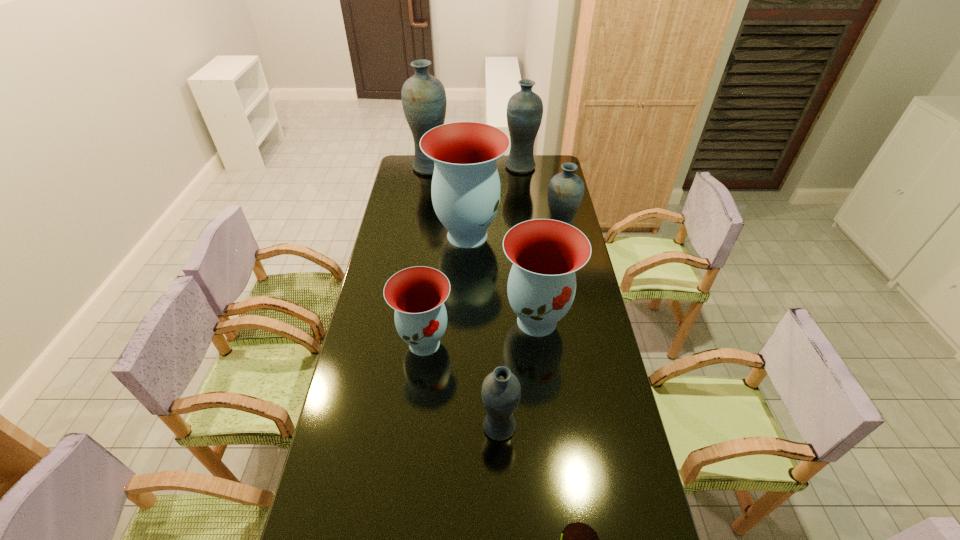
You are a GUI agent. You are given a task and a screenshot of the screen. Output one action in this format:
    pyautogui.click(x=<x>, y=<y>)
    Task: Click on the biggest blue vase
    Image resolution: width=960 pixels, height=540 pixels.
    Given the screenshot: What is the action you would take?
    pyautogui.click(x=424, y=101)

Find the location of a particular element. The image size is (960, 540). the tallest object is located at coordinates (424, 101).

At what (x,y) coordinates should I click in order to perform the action: click on the second biggest blue vase. Please return your answer as a coordinate pair (x, y). This screenshot has width=960, height=540. Looking at the image, I should click on (524, 112).

At what (x,y) coordinates should I click in order to perform the action: click on the biggest red vase. Please return your answer as a coordinate pair (x, y). This screenshot has height=540, width=960. Looking at the image, I should click on (466, 192).

Identify the location of the second smallest blue vase. The width and height of the screenshot is (960, 540). (566, 190).

The width and height of the screenshot is (960, 540). In order to click on the second biggest red vase in this screenshot , I will do `click(545, 253)`.

Where is `the smallest red vase`? the smallest red vase is located at coordinates (417, 294).

This screenshot has width=960, height=540. I want to click on the seventh farthest object, so click(501, 391).

Find the location of `the smallest blue vase`. the smallest blue vase is located at coordinates (501, 391).

Locate an element on the screen. The image size is (960, 540). free space located 0.050m on the left of the leftmost blue vase is located at coordinates (400, 167).